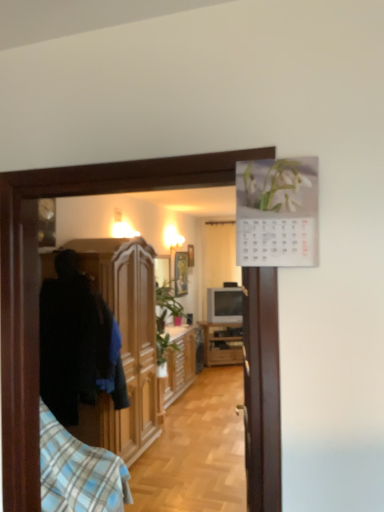
Question: Considering the positions of wooden cabinet at left, which is counted as the first cabinetry, starting from the front, and white sheer curtain at center in the image, is wooden cabinet at left, which is counted as the first cabinetry, starting from the front, taller or shorter than white sheer curtain at center?

Choices:
 (A) tall
 (B) short

Answer: (A)

Question: From the image's perspective, is wooden cabinet at left, which is counted as the first cabinetry, starting from the front, positioned above or below white sheer curtain at center?

Choices:
 (A) below
 (B) above

Answer: (A)

Question: Which object is positioned farthest from the wooden cabinet at center, the 2th cabinetry in the front-to-back sequence?

Choices:
 (A) matte gray television at center
 (B) blue plaid shirt at left
 (C) wooden cabinet at left, the third cabinetry in the back-to-front sequence
 (D) wooden cabinet at center, the third cabinetry viewed from the front
 (E) white sheer curtain at center

Answer: (E)

Question: Which object is the closest to the matte gray television at center?

Choices:
 (A) wooden picture frame at center
 (B) wooden cabinet at left, which is counted as the first cabinetry, starting from the front
 (C) wooden cabinet at center, the 2th cabinetry in the front-to-back sequence
 (D) wooden cabinet at center, acting as the 1th cabinetry starting from the back
 (E) blue plaid shirt at left

Answer: (D)